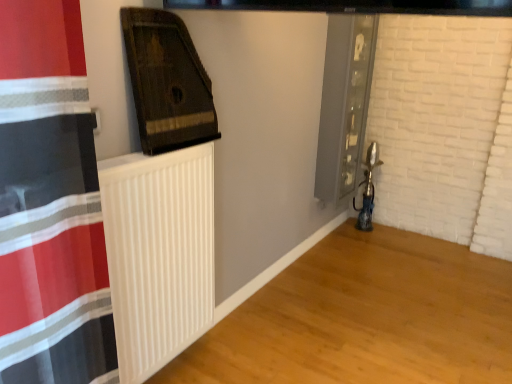
Question: In terms of height, does dark brown wood at upper left, arranged as the 1th wood when viewed from the top, look taller or shorter compared to white matte radiator at lower left, which ranks as the 2th wood in top-to-bottom order?

Choices:
 (A) tall
 (B) short

Answer: (A)

Question: Considering the relative positions of dark brown wood at upper left, placed as the second wood when sorted from bottom to top, and white matte radiator at lower left, which ranks as the 2th wood in top-to-bottom order, in the image provided, is dark brown wood at upper left, placed as the second wood when sorted from bottom to top, to the left or to the right of white matte radiator at lower left, which ranks as the 2th wood in top-to-bottom order,?

Choices:
 (A) right
 (B) left

Answer: (B)

Question: Which object is the closest to the metallic glass screen door at right?

Choices:
 (A) white matte radiator at lower left, which ranks as the 1th wood in right-to-left order
 (B) white ribbed radiator at center
 (C) dark brown wood at upper left, positioned as the first wood in left-to-right order

Answer: (A)

Question: Considering the real-world distances, which object is farthest from the white ribbed radiator at center?

Choices:
 (A) dark brown wood at upper left, arranged as the 1th wood when viewed from the top
 (B) white matte radiator at lower left, which ranks as the 2th wood in top-to-bottom order
 (C) metallic glass screen door at right

Answer: (C)